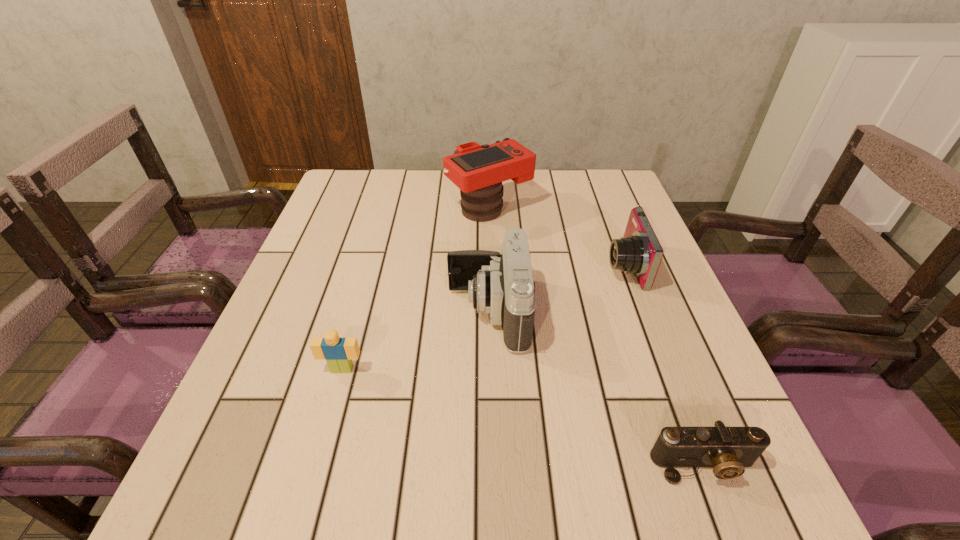
The image size is (960, 540). Find the location of `camera that stands as the closest to the second nearest object`. camera that stands as the closest to the second nearest object is located at coordinates (502, 285).

Locate which camera is the third closest to the fourth farthest object. Please provide its 2D coordinates. Your answer should be formatted as a tuple, i.e. [(x, y)], where the tuple contains the x and y coordinates of a point satisfying the conditions above.

[(728, 449)]

The image size is (960, 540). I want to click on free space that satisfies the following two spatial constraints: 1. on the front-facing side of the second shortest camera; 2. on the face of the Lego, so click(x=661, y=369).